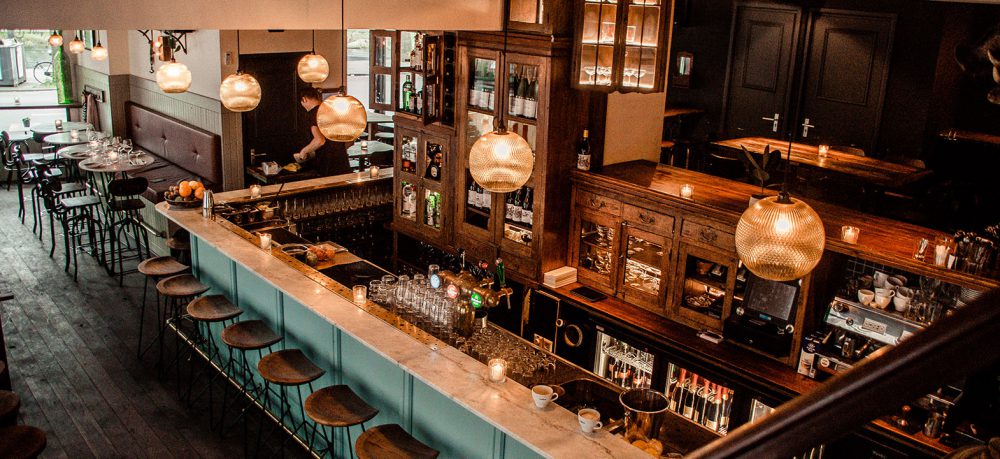
Where is `globe lighting fixtures`? The image size is (1000, 459). globe lighting fixtures is located at coordinates (56, 41), (78, 49), (101, 53), (174, 80), (237, 90), (318, 71), (343, 118), (504, 158), (788, 239).